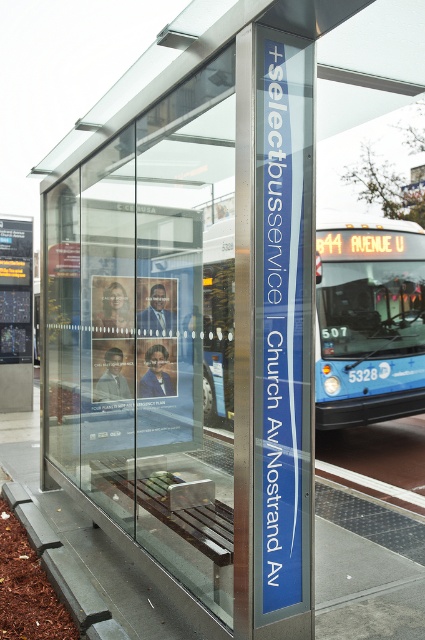
Question: Which of the following is the closest to the observer?

Choices:
 (A) (76, 524)
 (B) (74, 576)
 (C) (223, 272)

Answer: (B)

Question: Does brown wooden bench at lower center appear on the right side of gray concrete curb at lower left?

Choices:
 (A) yes
 (B) no

Answer: (A)

Question: Considering the relative positions of blue metallic bus at center and gray concrete curb at lower left in the image provided, where is blue metallic bus at center located with respect to gray concrete curb at lower left?

Choices:
 (A) above
 (B) below

Answer: (A)

Question: Among these points, which one is farthest from the camera?

Choices:
 (A) (96, 593)
 (B) (354, 392)
 (C) (351, 592)

Answer: (B)

Question: Is brown wooden bench at lower center smaller than gray concrete curb at lower left?

Choices:
 (A) yes
 (B) no

Answer: (A)

Question: Considering the real-world distances, which object is closest to the gray concrete curb at lower left?

Choices:
 (A) brown wooden bench at lower center
 (B) blue metallic bus at center

Answer: (A)